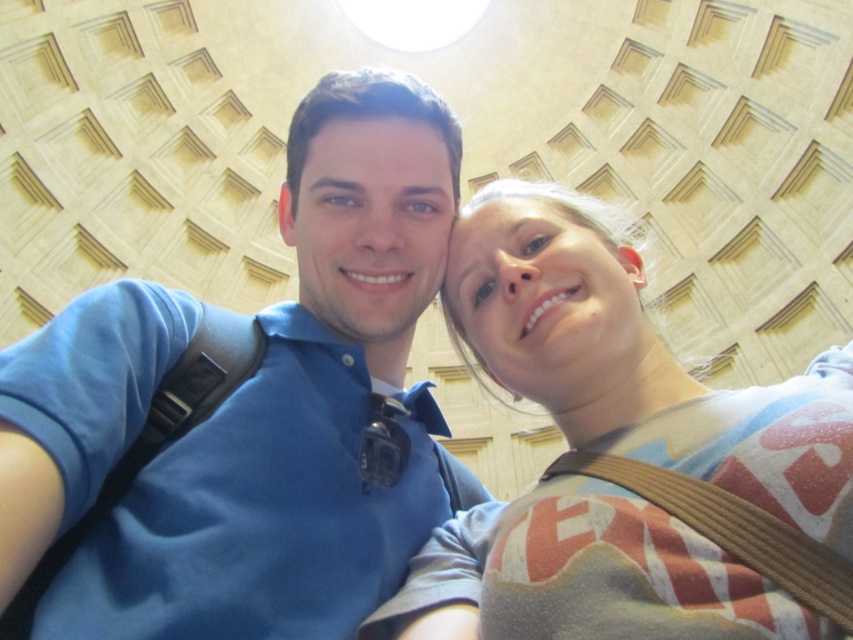
Is blue cotton shirt at center to the left of light brown cotton shirt at center from the viewer's perspective?

Correct, you'll find blue cotton shirt at center to the left of light brown cotton shirt at center.

Can you confirm if blue cotton shirt at center is bigger than light brown cotton shirt at center?

Yes.

Which is in front, point (149, 612) or point (485, 248)?

Point (149, 612) is in front.

In order to click on blue cotton shirt at center in this screenshot , I will do `click(300, 410)`.